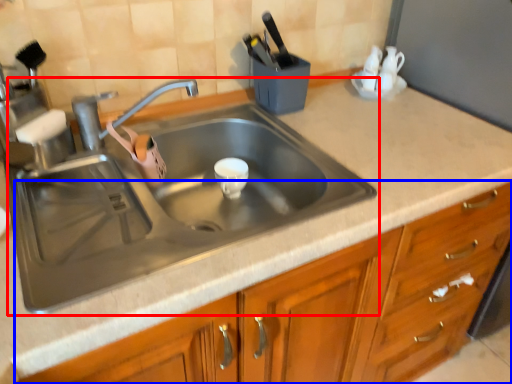
Question: Which object is further to the camera taking this photo, sink (highlighted by a red box) or cabinetry (highlighted by a blue box)?

Choices:
 (A) sink
 (B) cabinetry

Answer: (A)